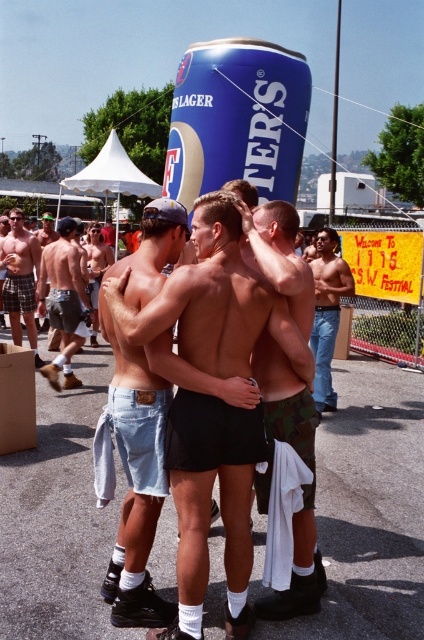
Looking at this image, which is more to the right, blue matte beer can at center or jeans at center?

jeans at center is more to the right.

Can you confirm if blue matte beer can at center is positioned above jeans at center?

Indeed, blue matte beer can at center is positioned over jeans at center.

Is point (248, 170) less distant than point (334, 257)?

That is False.

Identify the location of blue matte beer can at center. This screenshot has height=640, width=424. (237, 118).

Does point (323, 272) lie in front of point (13, 260)?

Yes, point (323, 272) is closer to viewer.

Does jeans at center have a greater width compared to plaid shorts at left?

In fact, jeans at center might be narrower than plaid shorts at left.

What do you see at coordinates (326, 314) in the screenshot?
I see `jeans at center` at bounding box center [326, 314].

I want to click on jeans at center, so click(326, 314).

Which is more to the left, blue matte beer can at center or plaid shorts at left?

plaid shorts at left

The height and width of the screenshot is (640, 424). I want to click on blue matte beer can at center, so click(237, 118).